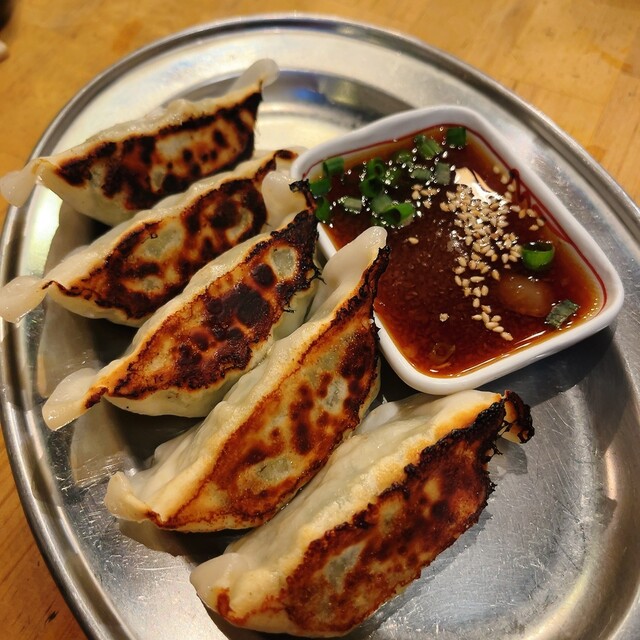
Locate an element on the screen. brown wood table is located at coordinates (592, 93).